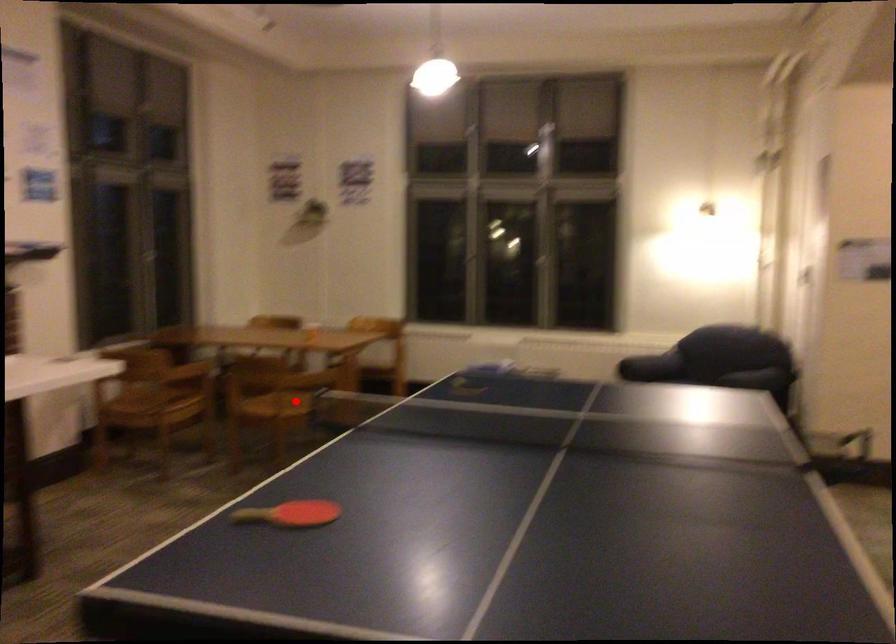
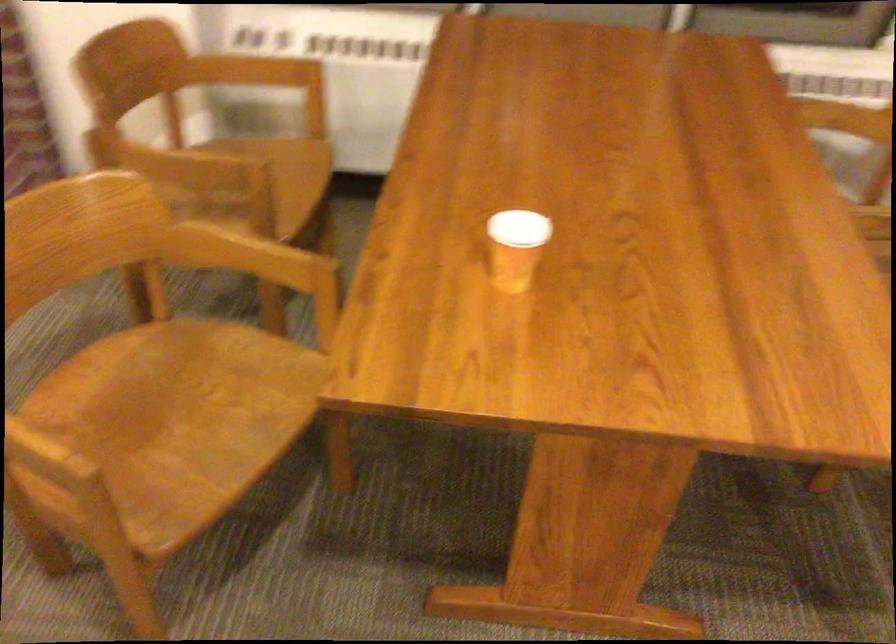
Where in the second image is the point corresponding to the highlighted location from the first image?

(170, 424)